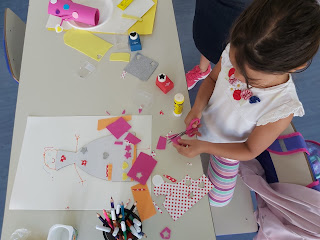
What are the coordinates of `foam` in the screenshot? It's located at (92, 39).